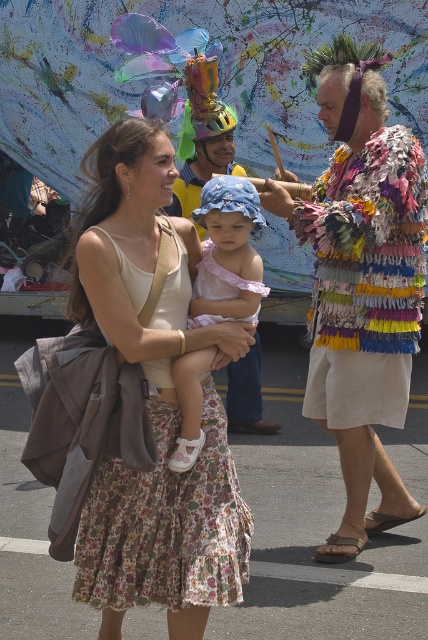
You are a photographer trying to capture both the floral cotton dress at center and the matte pink fabric dress at center in a single frame. Given that your camera has a minimum focus distance of 10 inches, will you be able to focus on both dresses simultaneously?

The floral cotton dress at center is 9.88 inches away from the matte pink fabric dress at center, which is less than the camera minimum focus distance of 10 inches. Therefore, the camera cannot focus on both dresses simultaneously.

You are a photographer trying to capture both the floral cotton dress at center and the matte pink fabric dress at center in a single shot. Which dress should you focus on first to ensure both are in frame?

The floral cotton dress at center is positioned under the matte pink fabric dress at center, so you should focus on the matte pink fabric dress at center first to ensure both are in frame.

Consider the image. You are a photographer trying to capture both the floral cotton dress at center and the matte pink fabric dress at center in the same frame. Which dress should you focus on first to ensure both are in focus?

The floral cotton dress at center is closer to the viewer than the matte pink fabric dress at center, so focus on the floral cotton dress at center first to ensure both are in focus.